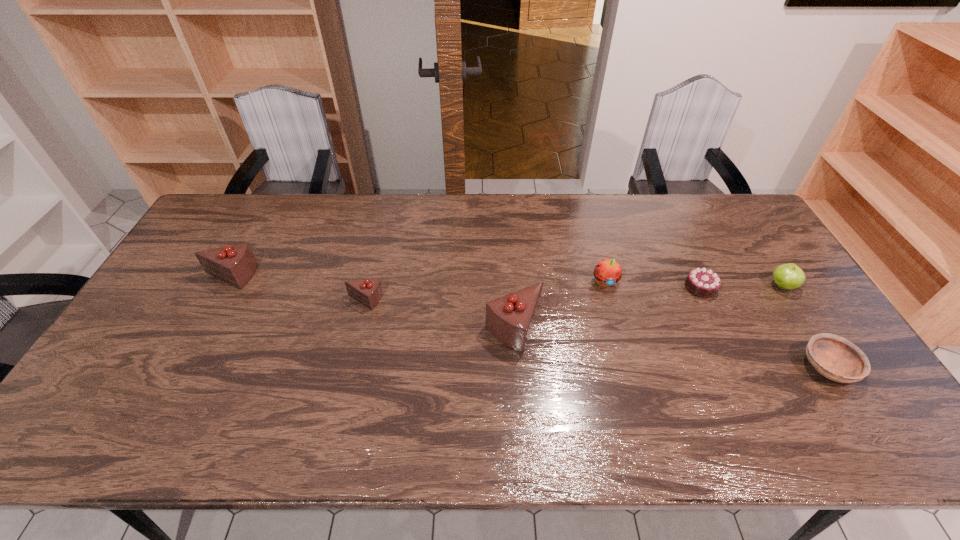
All chocolate cakes are currently evenly spaced. To continue this pattern, where would you add another chocolate cake on the right? Please point out a vacant spot. Please provide its 2D coordinates. Your answer should be formatted as a tuple, i.e. [(x, y)], where the tuple contains the x and y coordinates of a point satisfying the conditions above.

[(683, 359)]